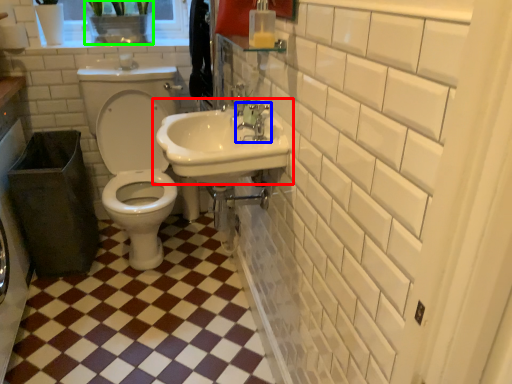
Question: Estimate the real-world distances between objects in this image. Which object is closer to sink (highlighted by a red box), tap (highlighted by a blue box) or plant (highlighted by a green box)?

Choices:
 (A) tap
 (B) plant

Answer: (A)